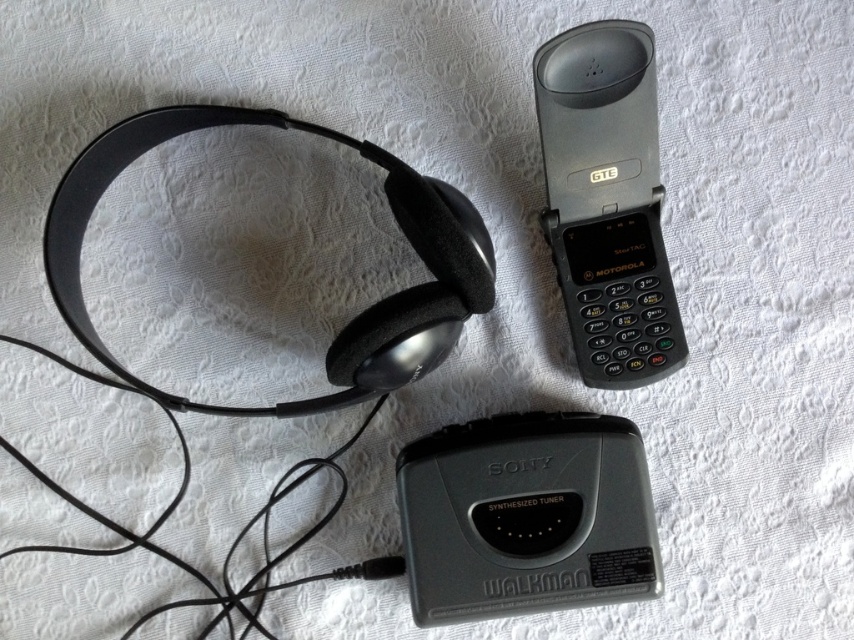
Is gray matte walkman at center wider than black plastic phone at upper right?

Indeed, gray matte walkman at center has a greater width compared to black plastic phone at upper right.

What are the coordinates of `gray matte walkman at center` in the screenshot? It's located at (525, 516).

This screenshot has width=854, height=640. Find the location of `gray matte walkman at center`. gray matte walkman at center is located at coordinates (525, 516).

Who is more forward, (572, 252) or (404, 308)?

Point (404, 308) is more forward.

Who is shorter, black plastic phone at upper right or matte black headphones at upper left?

matte black headphones at upper left

This screenshot has height=640, width=854. What do you see at coordinates (606, 202) in the screenshot?
I see `black plastic phone at upper right` at bounding box center [606, 202].

What are the coordinates of `black plastic phone at upper right` in the screenshot? It's located at (606, 202).

Who is lower down, gray matte walkman at center or matte black headphones at upper left?

gray matte walkman at center is below.

Who is more distant from viewer, (x=525, y=604) or (x=79, y=248)?

Positioned behind is point (x=79, y=248).

The width and height of the screenshot is (854, 640). Find the location of `gray matte walkman at center`. gray matte walkman at center is located at coordinates (525, 516).

Where is `gray matte walkman at center`? The width and height of the screenshot is (854, 640). gray matte walkman at center is located at coordinates pos(525,516).